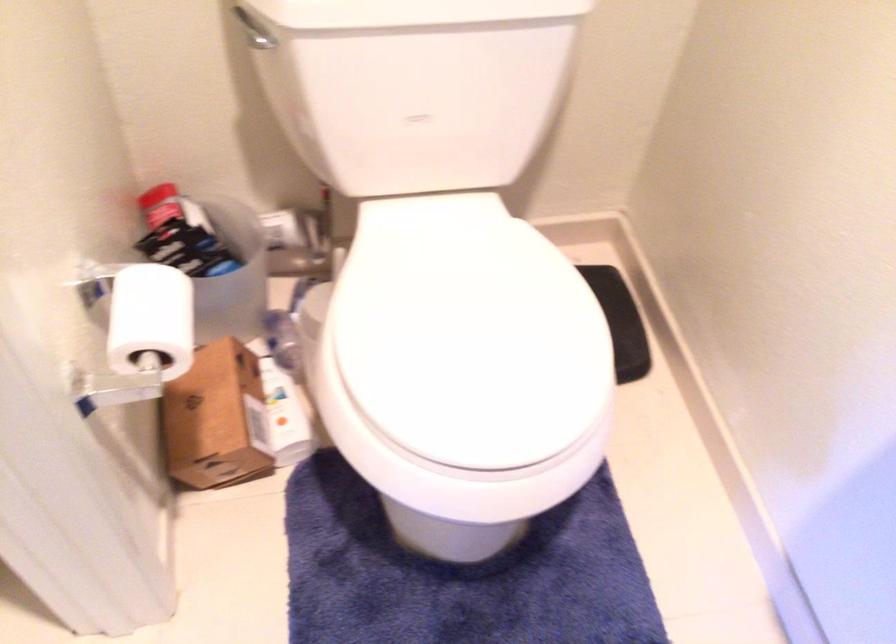
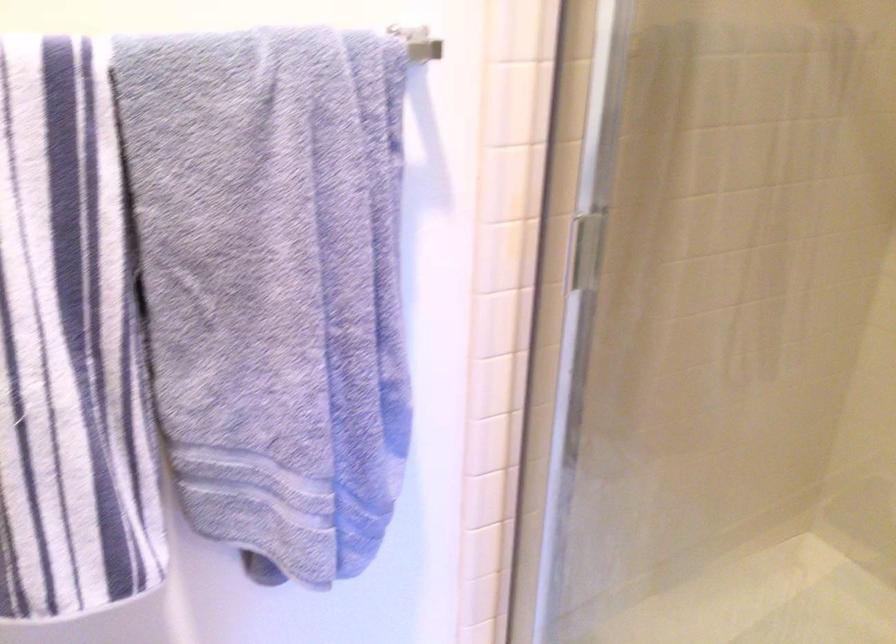
The images are taken continuously from a first-person perspective. In which direction is your viewpoint rotating?

The camera rotated toward right-down.